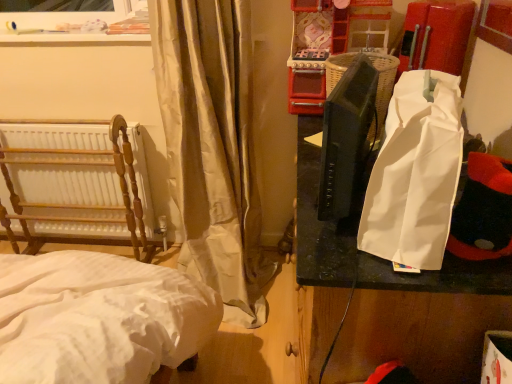
Question: Can you confirm if silky beige curtain at left is thinner than white paper bag at right?

Choices:
 (A) yes
 (B) no

Answer: (B)

Question: Is silky beige curtain at left shorter than white paper bag at right?

Choices:
 (A) yes
 (B) no

Answer: (B)

Question: From a real-world perspective, is silky beige curtain at left over white paper bag at right?

Choices:
 (A) no
 (B) yes

Answer: (A)

Question: Is silky beige curtain at left far away from white paper bag at right?

Choices:
 (A) yes
 (B) no

Answer: (B)

Question: Is white paper bag at right inside silky beige curtain at left?

Choices:
 (A) yes
 (B) no

Answer: (B)

Question: Choose the correct answer: Is silky beige curtain at left inside wooden radiator at left or outside it?

Choices:
 (A) inside
 (B) outside

Answer: (B)

Question: From a real-world perspective, is silky beige curtain at left above or below wooden radiator at left?

Choices:
 (A) above
 (B) below

Answer: (A)

Question: Is silky beige curtain at left bigger or smaller than wooden radiator at left?

Choices:
 (A) small
 (B) big

Answer: (B)

Question: From the image's perspective, is silky beige curtain at left located above or below wooden radiator at left?

Choices:
 (A) above
 (B) below

Answer: (A)

Question: Is point (390, 178) closer or farther from the camera than point (41, 127)?

Choices:
 (A) closer
 (B) farther

Answer: (A)

Question: Looking at the image, does white paper bag at right seem bigger or smaller compared to wooden radiator at left?

Choices:
 (A) small
 (B) big

Answer: (A)

Question: In the image, is white paper bag at right on the left side or the right side of wooden radiator at left?

Choices:
 (A) left
 (B) right

Answer: (B)

Question: From a real-world perspective, is white paper bag at right physically located above or below wooden radiator at left?

Choices:
 (A) above
 (B) below

Answer: (A)

Question: Is point (205, 172) closer or farther from the camera than point (327, 246)?

Choices:
 (A) closer
 (B) farther

Answer: (B)

Question: Do you think silky beige curtain at left is within white paper bag at right, or outside of it?

Choices:
 (A) inside
 (B) outside

Answer: (B)